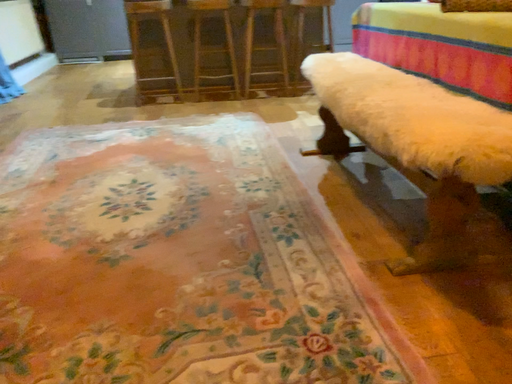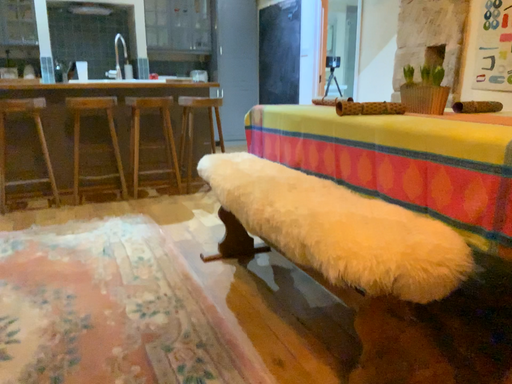
Question: How did the camera likely rotate when shooting the video?

Choices:
 (A) rotated upward
 (B) rotated downward

Answer: (A)